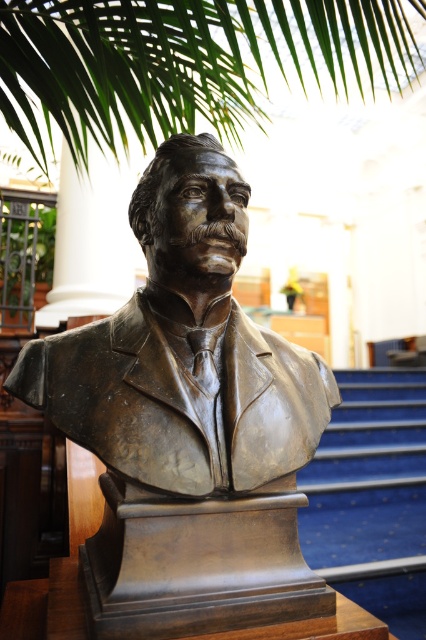
You are standing in front of the bronze bust sculpture of a man. There is a point at coordinates point (22, 353). Can you reach this point with your hand without moving your feet?

The point at point (22, 353) is 1.24 meters from the camera. Since the average person can reach about 2 meters, you can reach it without moving your feet.

You are an interior designer assessing the placement of the bronze bust at center and the blue carpet at center in a room. Which object is positioned higher from the floor?

The bronze bust at center is located above the blue carpet at center, so it is positioned higher from the floor.

You are an interior designer planning to place a new decorative item between the bronze bust at center and the blue carpet at center. Based on their widths, which object should you consider moving to ensure the new item fits comfortably?

The bronze bust at center has a lesser width compared to the blue carpet at center. Therefore, you should consider moving the bronze bust at center to accommodate the new decorative item, as it occupies less space.